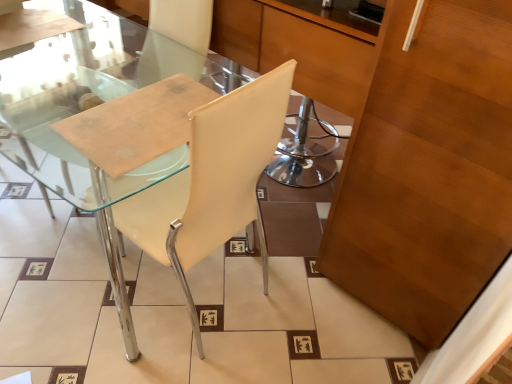
Question: From a real-world perspective, is transparent glass table at left positioned under white leather chair at center based on gravity?

Choices:
 (A) yes
 (B) no

Answer: (B)

Question: Are transparent glass table at left and white leather chair at center far apart?

Choices:
 (A) no
 (B) yes

Answer: (A)

Question: Does transparent glass table at left appear on the left side of white leather chair at center?

Choices:
 (A) no
 (B) yes

Answer: (B)

Question: Is transparent glass table at left facing towards white leather chair at center?

Choices:
 (A) no
 (B) yes

Answer: (A)

Question: Does transparent glass table at left appear on the right side of white leather chair at center?

Choices:
 (A) yes
 (B) no

Answer: (B)

Question: From their relative heights in the image, would you say transparent glass table at left is taller or shorter than wooden cabinet at right?

Choices:
 (A) tall
 (B) short

Answer: (B)

Question: Considering the positions of transparent glass table at left and wooden cabinet at right in the image, is transparent glass table at left bigger or smaller than wooden cabinet at right?

Choices:
 (A) small
 (B) big

Answer: (A)

Question: Would you say transparent glass table at left is to the left or to the right of wooden cabinet at right in the picture?

Choices:
 (A) left
 (B) right

Answer: (A)

Question: Considering the positions of point (28, 145) and point (406, 18), is point (28, 145) closer or farther from the camera than point (406, 18)?

Choices:
 (A) farther
 (B) closer

Answer: (A)

Question: In the image, is white leather chair at center on the left side or the right side of wooden cabinet at right?

Choices:
 (A) right
 (B) left

Answer: (B)

Question: In the image, is white leather chair at center positioned in front of or behind wooden cabinet at right?

Choices:
 (A) front
 (B) behind

Answer: (B)

Question: From their relative heights in the image, would you say white leather chair at center is taller or shorter than wooden cabinet at right?

Choices:
 (A) tall
 (B) short

Answer: (B)

Question: Looking at the image, does white leather chair at center seem bigger or smaller compared to wooden cabinet at right?

Choices:
 (A) big
 (B) small

Answer: (B)

Question: Considering the positions of point pyautogui.click(x=445, y=29) and point pyautogui.click(x=10, y=130), is point pyautogui.click(x=445, y=29) closer or farther from the camera than point pyautogui.click(x=10, y=130)?

Choices:
 (A) farther
 (B) closer

Answer: (B)

Question: In terms of height, does wooden cabinet at right look taller or shorter compared to transparent glass table at left?

Choices:
 (A) short
 (B) tall

Answer: (B)